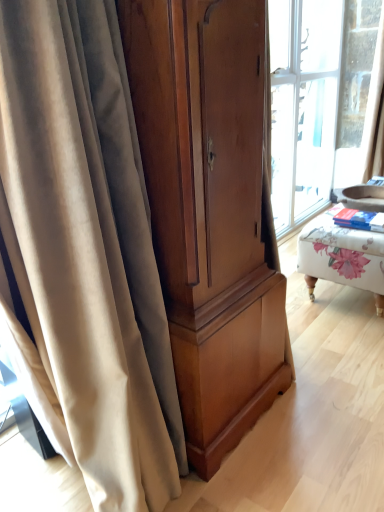
Question: From a real-world perspective, is beige velvet curtain at left above or below matte wood cabinet at center?

Choices:
 (A) below
 (B) above

Answer: (A)

Question: Visually, is beige velvet curtain at left positioned to the left or to the right of matte wood cabinet at center?

Choices:
 (A) left
 (B) right

Answer: (A)

Question: Considering the real-world distances, which object is closest to the floral fabric ottoman at right?

Choices:
 (A) beige velvet curtain at left
 (B) matte wood cabinet at center

Answer: (B)

Question: Which object is the farthest from the beige velvet curtain at left?

Choices:
 (A) matte wood cabinet at center
 (B) floral fabric ottoman at right

Answer: (B)